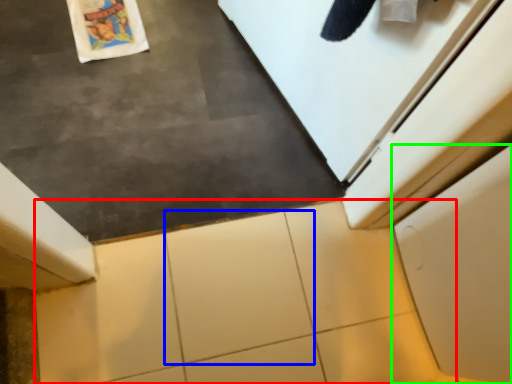
Question: Estimate the real-world distances between objects in this image. Which object is closer to tile (highlighted by a red box), granite (highlighted by a blue box) or cabinetry (highlighted by a green box)?

Choices:
 (A) granite
 (B) cabinetry

Answer: (A)